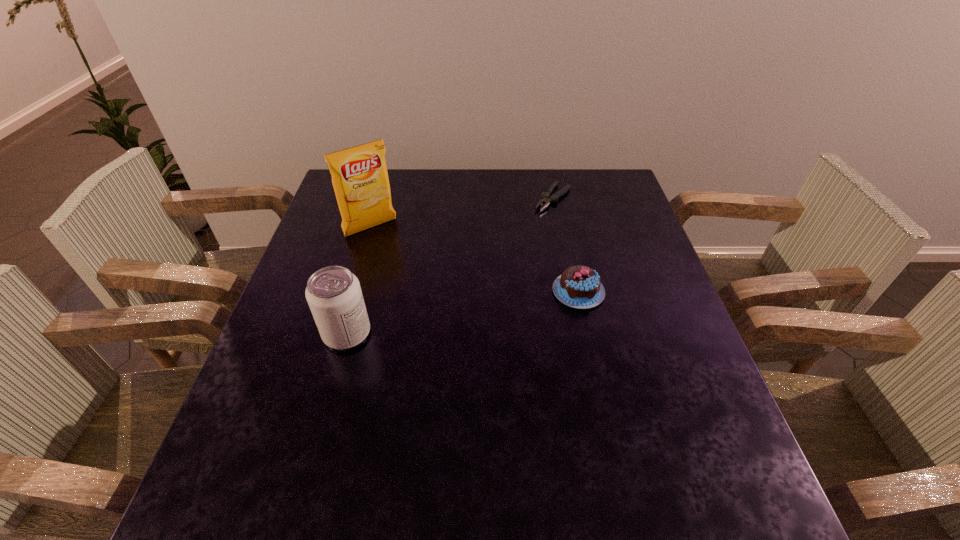
Identify the location of the third shortest object. (333, 293).

The height and width of the screenshot is (540, 960). I want to click on the nearest object, so click(333, 293).

This screenshot has height=540, width=960. In order to click on the second nearest object in this screenshot , I will do `click(579, 286)`.

This screenshot has height=540, width=960. Identify the location of chocolate cake. (579, 286).

This screenshot has width=960, height=540. Find the location of `the tallest object`. the tallest object is located at coordinates pyautogui.click(x=360, y=179).

This screenshot has height=540, width=960. Find the location of `crisp (potato chip)`. crisp (potato chip) is located at coordinates (360, 179).

Image resolution: width=960 pixels, height=540 pixels. What are the coordinates of `the farthest object` in the screenshot? It's located at (547, 199).

The height and width of the screenshot is (540, 960). Identify the location of pliers. (547, 199).

Image resolution: width=960 pixels, height=540 pixels. Find the location of `free space located 0.260m on the back of the nearest object`. free space located 0.260m on the back of the nearest object is located at coordinates (372, 244).

You are a GUI agent. You are given a task and a screenshot of the screen. Output one action in this format:
    pyautogui.click(x=<x>, y=<y>)
    Task: Click on the vacant space situated on the back of the third tallest object
    The height and width of the screenshot is (540, 960).
    Given the screenshot: What is the action you would take?
    pyautogui.click(x=566, y=239)